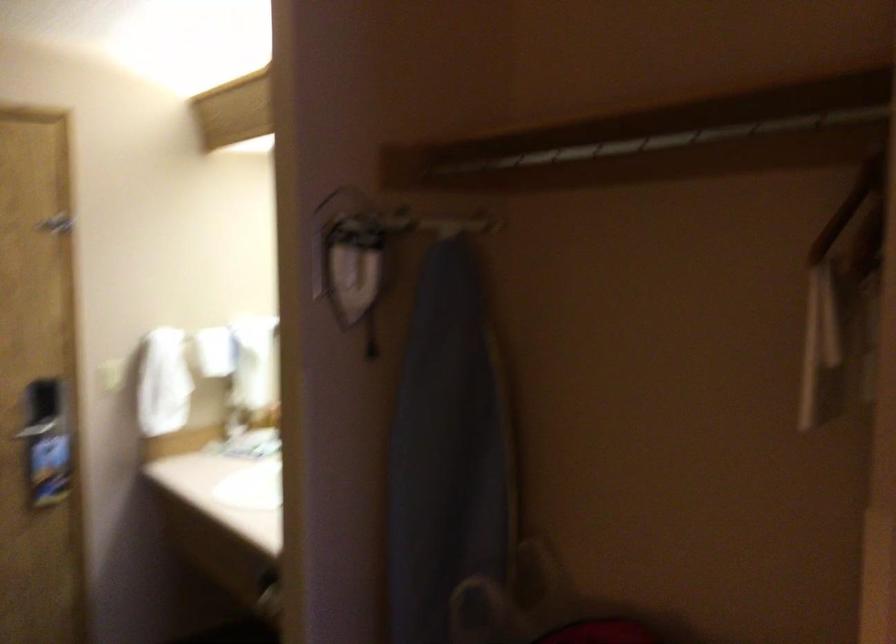
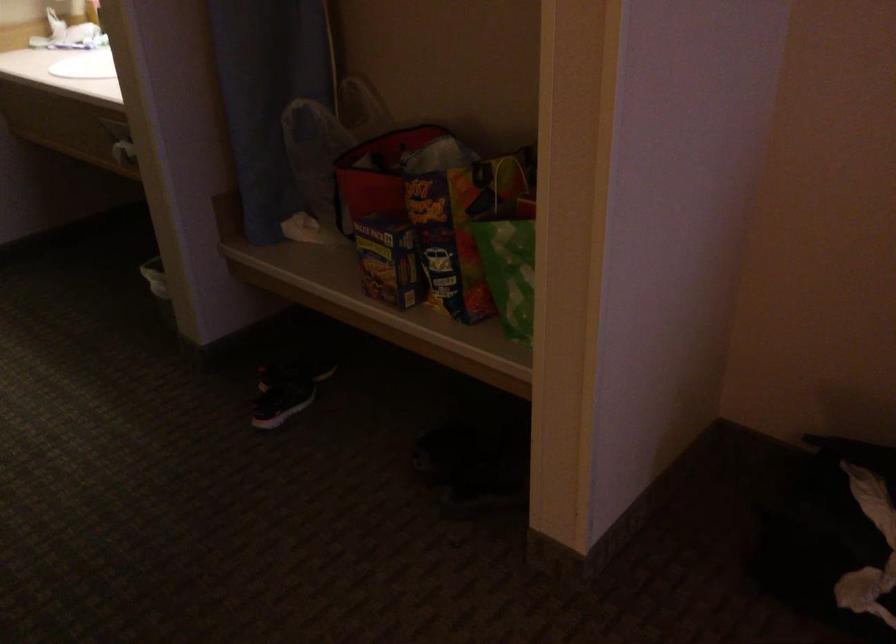
Question: The images are taken continuously from a first-person perspective. In which direction are you moving?

Choices:
 (A) Left
 (B) Right
 (C) Forward
 (D) Backward

Answer: (D)